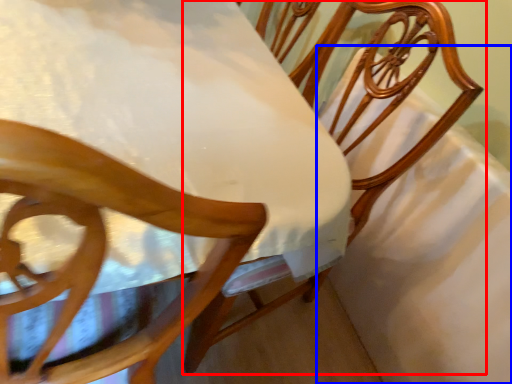
Question: Which object is closer to the camera taking this photo, chair (highlighted by a red box) or sheet (highlighted by a blue box)?

Choices:
 (A) chair
 (B) sheet

Answer: (A)